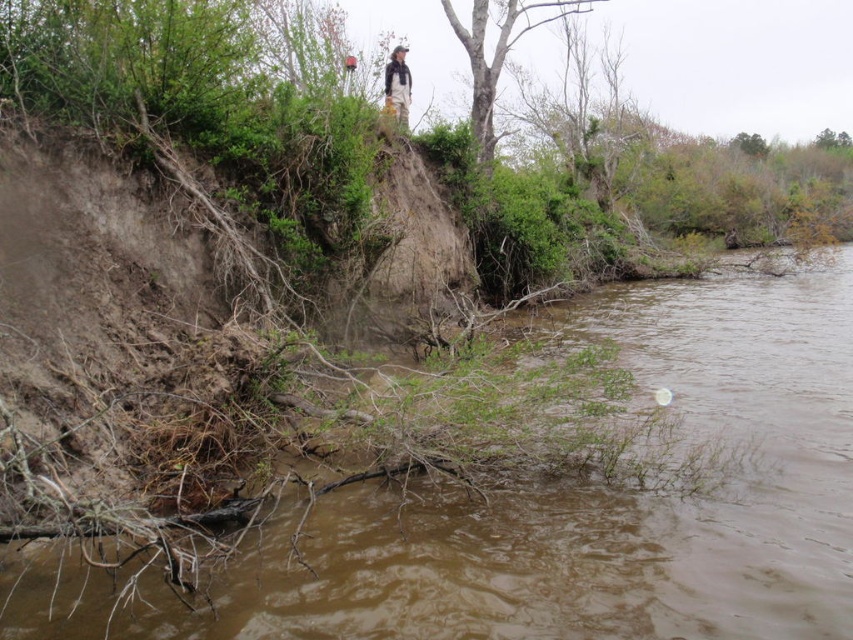
You are standing on the riverbank and see the brown muddy water at lower left and the khaki pants at upper center. Which object is closer to the water surface?

The brown muddy water at lower left is positioned under the khaki pants at upper center, so it is closer to the water surface.

You are standing at the riverbank and want to place a marker at point (801, 432) and another marker at point (480, 115). Which marker will be closer to your current position?

The marker at point (801, 432) will be closer to your current position because it is closer to the camera than point (480, 115).

You are a geologist analyzing the riverbank erosion. You need to mark the exact 2D coordinates of the smooth bark tree at upper center in the image for your report. What are its coordinates?

The smooth bark tree at upper center is located at coordinates [495,58].